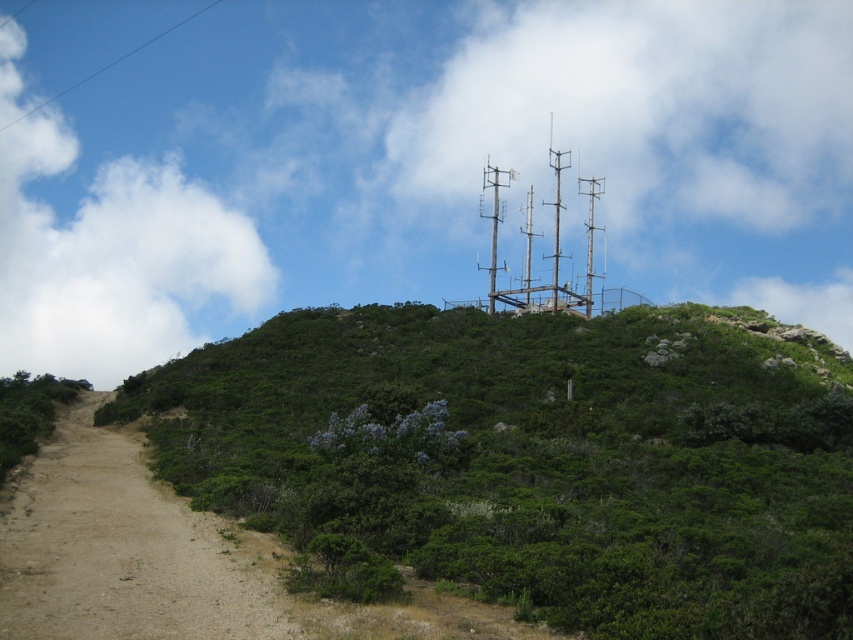
Question: In this image, where is green leafy shrubs at upper center located relative to metallic gray antenna at upper center?

Choices:
 (A) below
 (B) above

Answer: (A)

Question: Does green leafy shrubs at upper center have a larger size compared to metallic silver antenna at center?

Choices:
 (A) no
 (B) yes

Answer: (B)

Question: Which of the following is the farthest from the observer?

Choices:
 (A) (534, 458)
 (B) (844, 259)
 (C) (482, 189)
 (D) (553, 256)

Answer: (B)

Question: Which of the following is the farthest from the observer?

Choices:
 (A) (489, 259)
 (B) (67, 339)
 (C) (347, 385)
 (D) (212, 106)

Answer: (B)

Question: Considering the relative positions of white fluffy cloud at upper center and metallic gray antenna at upper center in the image provided, where is white fluffy cloud at upper center located with respect to metallic gray antenna at upper center?

Choices:
 (A) right
 (B) left

Answer: (B)

Question: Which object is farther from the camera taking this photo?

Choices:
 (A) metallic gray antennas at upper center
 (B) green leafy shrubs at upper center
 (C) metallic gray antenna at upper center

Answer: (A)